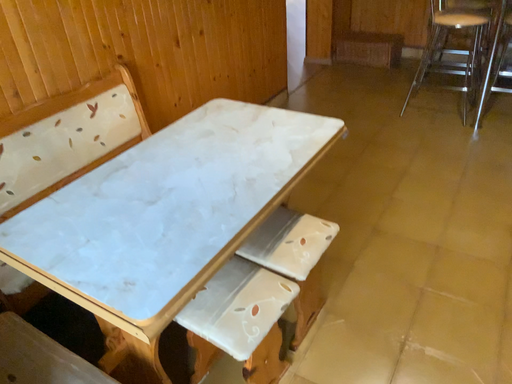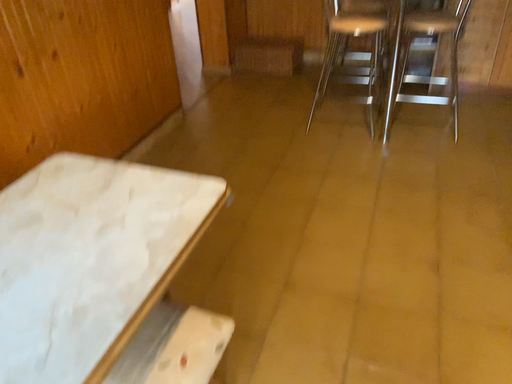
Question: Which way did the camera rotate in the video?

Choices:
 (A) rotated left
 (B) rotated right

Answer: (B)